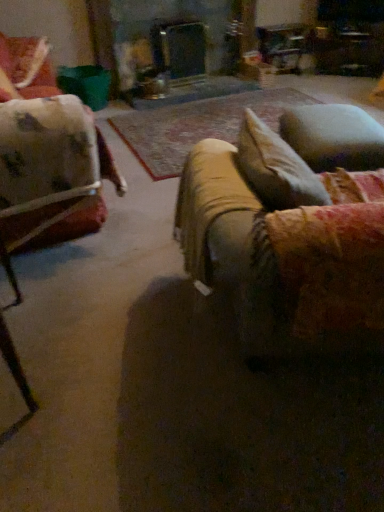
Question: Is velvety blue pillow at right taller or shorter than velvet beige couch at center?

Choices:
 (A) short
 (B) tall

Answer: (A)

Question: Relative to velvet beige couch at center, is velvety blue pillow at right in front or behind?

Choices:
 (A) behind
 (B) front

Answer: (A)

Question: Which object is the farthest from the velvet beige couch at center?

Choices:
 (A) velvety blue pillow at right
 (B) velvet floral chair at upper left

Answer: (B)

Question: Which is nearer to the velvet beige couch at center?

Choices:
 (A) velvety blue pillow at right
 (B) velvet floral chair at upper left

Answer: (A)